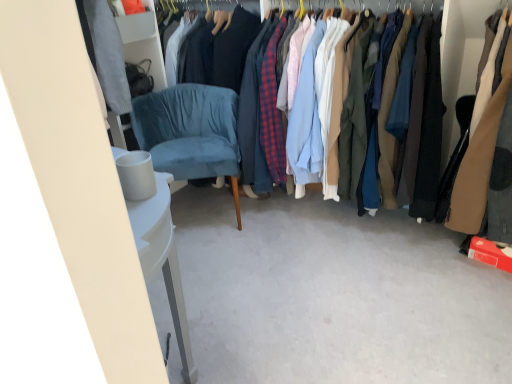
In order to click on free space in front of velvet blue armchair at center-left in this screenshot , I will do [234, 263].